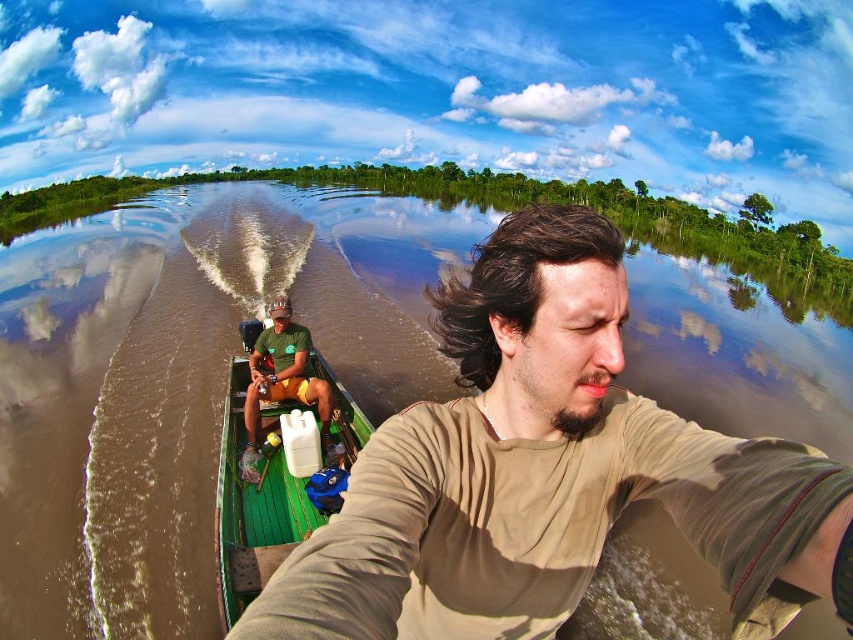
You are standing at the riverbank and see two people in the scene. The first person is wearing a brown matte shirt at center, and the second is wearing a green matte shirt at center. Which shirt is positioned more to the east?

The brown matte shirt at center is positioned more to the east since it is to the right of the green matte shirt at center, and the river flows from west to east.

You are standing on the riverbank and see both the green wooden boat at center and the green matte shirt at center. Which object is closer to your left side?

The green wooden boat at center is to the left of the green matte shirt at center, so the green wooden boat at center is closer to your left side.